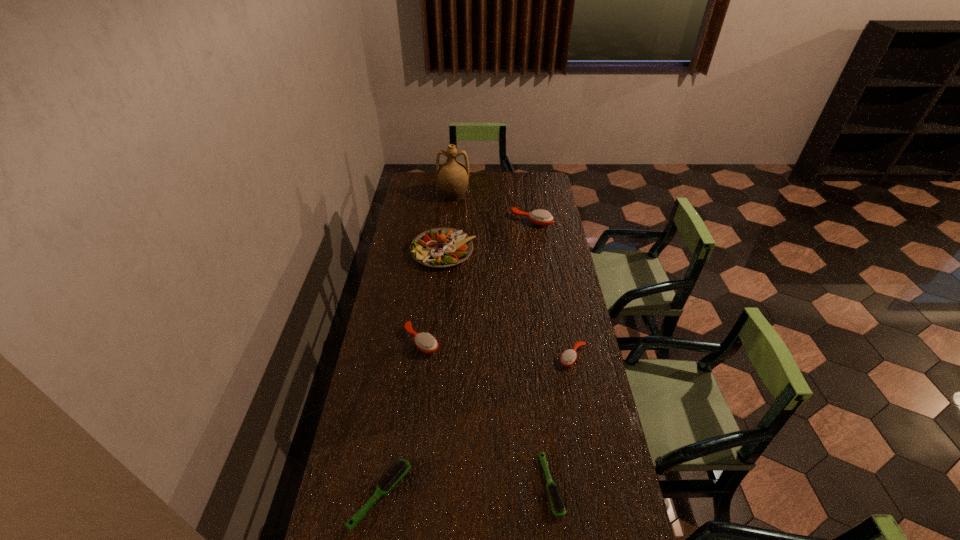
Find the location of a particular element. Image resolution: width=960 pixels, height=540 pixels. vacant area that lies between the shortest hairbrush and the left light hairbrush is located at coordinates (466, 490).

Locate an element on the screen. This screenshot has height=540, width=960. unoccupied position between the right light hairbrush and the salad plate is located at coordinates (497, 368).

Locate an element on the screen. Image resolution: width=960 pixels, height=540 pixels. free spot between the smallest orange hairbrush and the second farthest object is located at coordinates (552, 289).

At what (x,y) coordinates should I click in order to perform the action: click on object that ranks as the second closest to the smallest orange hairbrush. Please return your answer as a coordinate pair (x, y). Looking at the image, I should click on (425, 342).

You are a GUI agent. You are given a task and a screenshot of the screen. Output one action in this format:
    pyautogui.click(x=<x>, y=<y>)
    Task: Click on the sixth closest object relative to the farthest object
    The width and height of the screenshot is (960, 540).
    Given the screenshot: What is the action you would take?
    pyautogui.click(x=400, y=468)

You are a GUI agent. You are given a task and a screenshot of the screen. Output one action in this format:
    pyautogui.click(x=<x>, y=<y>)
    Task: Click on the closest hairbrush to the tallest hairbrush
    This screenshot has width=960, height=540.
    Given the screenshot: What is the action you would take?
    point(425,342)

At what (x,y) coordinates should I click in order to perform the action: click on hairbrush that stands as the fifth closest to the fifth nearest object. Please return your answer as a coordinate pair (x, y). This screenshot has height=540, width=960. Looking at the image, I should click on (557, 504).

Identify the location of orange hairbrush that is the third nearest to the salad plate. The height and width of the screenshot is (540, 960). (568, 357).

Locate an element on the screen. the second closest orange hairbrush to the second tallest object is located at coordinates (425, 342).

Identify the location of light hairbrush that can be found as the second closest to the third farthest object. (557, 504).